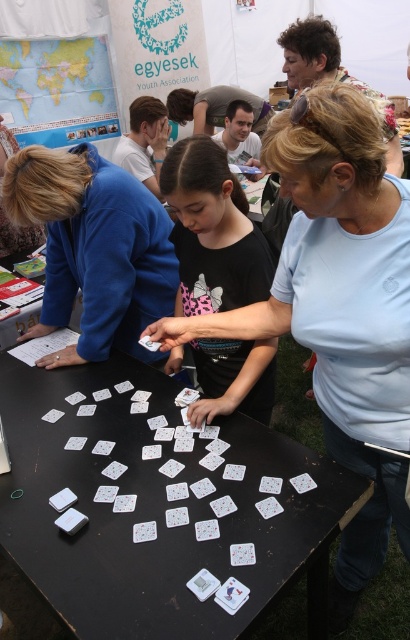
Question: Is white paper cards at center above white matte card at center?

Choices:
 (A) no
 (B) yes

Answer: (B)

Question: Which point appears closest to the camera in this image?

Choices:
 (A) (136, 266)
 (B) (250, 548)
 (C) (141, 467)
 (D) (377, 218)

Answer: (D)

Question: Does blue fabric jacket at upper left appear over white paper card at center?

Choices:
 (A) yes
 (B) no

Answer: (A)

Question: Is light blue cotton shirt at center smaller than black matte shirt at center?

Choices:
 (A) yes
 (B) no

Answer: (B)

Question: Which is nearer to the light blue cotton shirt at center?

Choices:
 (A) white matte card at center
 (B) blue fabric jacket at upper left
 (C) black matte shirt at center

Answer: (C)

Question: Which point is farther to the camera?

Choices:
 (A) white paper card at center
 (B) white matte card at center
 (C) light blue cotton shirt at center
 (D) blue fabric jacket at upper left

Answer: (D)